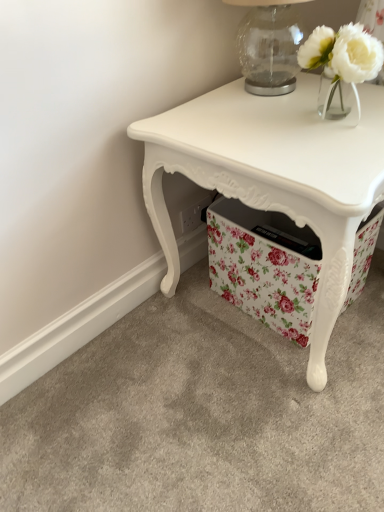
I want to click on vacant area that lies between white glass vase at upper right and transparent glass table lamp at upper right, so click(309, 98).